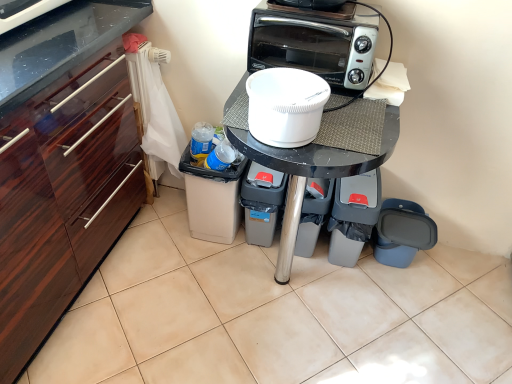
Question: Does gray plastic trash can at lower center, which is the 3th appliance in right-to-left order, have a lesser width compared to white plastic container at center?

Choices:
 (A) yes
 (B) no

Answer: (B)

Question: From the image's perspective, does gray plastic trash can at lower center, which is the 3th appliance in right-to-left order, appear lower than white plastic container at center?

Choices:
 (A) yes
 (B) no

Answer: (A)

Question: Is gray plastic trash can at lower center, which is the 3th appliance in right-to-left order, far away from white plastic container at center?

Choices:
 (A) no
 (B) yes

Answer: (A)

Question: Is gray plastic trash can at lower center, which is the 3th appliance in right-to-left order, bigger than white plastic container at center?

Choices:
 (A) no
 (B) yes

Answer: (B)

Question: Is gray plastic trash can at lower center, positioned as the 2th appliance in left-to-right order, not inside white plastic container at center?

Choices:
 (A) no
 (B) yes

Answer: (B)

Question: Do you think white plastic container at center is within gray plastic trash bin at lower center, which is counted as the 4th appliance, starting from the right, or outside of it?

Choices:
 (A) inside
 (B) outside

Answer: (B)

Question: Is white plastic container at center in front of or behind gray plastic trash bin at lower center, which is counted as the 4th appliance, starting from the right, in the image?

Choices:
 (A) behind
 (B) front

Answer: (B)

Question: In terms of height, does white plastic container at center look taller or shorter compared to gray plastic trash bin at lower center, which is counted as the 4th appliance, starting from the right?

Choices:
 (A) short
 (B) tall

Answer: (A)

Question: From the image's perspective, relative to gray plastic trash bin at lower center, which is counted as the 4th appliance, starting from the right, is white plastic container at center above or below?

Choices:
 (A) above
 (B) below

Answer: (A)

Question: Relative to blue plastic trash can at lower right, which appears as the fourth appliance when viewed from the left, is gray plastic trash can at lower center, positioned as the 2th appliance in left-to-right order, in front or behind?

Choices:
 (A) behind
 (B) front

Answer: (B)

Question: Considering the positions of gray plastic trash can at lower center, which is the 3th appliance in right-to-left order, and blue plastic trash can at lower right, acting as the 1th appliance starting from the right, in the image, is gray plastic trash can at lower center, which is the 3th appliance in right-to-left order, taller or shorter than blue plastic trash can at lower right, acting as the 1th appliance starting from the right,?

Choices:
 (A) tall
 (B) short

Answer: (A)

Question: From the image's perspective, is gray plastic trash can at lower center, positioned as the 2th appliance in left-to-right order, located above or below blue plastic trash can at lower right, which appears as the fourth appliance when viewed from the left?

Choices:
 (A) above
 (B) below

Answer: (A)

Question: Visually, is gray plastic trash can at lower center, which is the 3th appliance in right-to-left order, positioned to the left or to the right of blue plastic trash can at lower right, acting as the 1th appliance starting from the right?

Choices:
 (A) left
 (B) right

Answer: (A)

Question: Considering the positions of black glossy table at center and white plastic container at center in the image, is black glossy table at center wider or thinner than white plastic container at center?

Choices:
 (A) wide
 (B) thin

Answer: (A)

Question: In terms of size, does black glossy table at center appear bigger or smaller than white plastic container at center?

Choices:
 (A) small
 (B) big

Answer: (B)